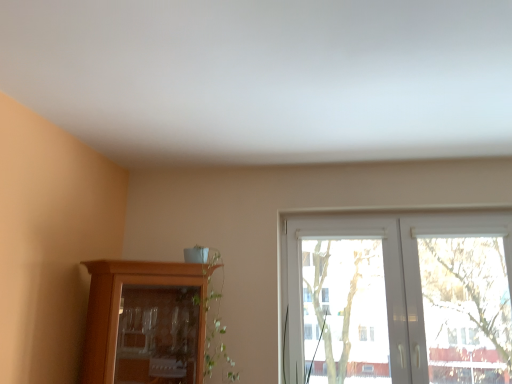
Question: Is wooden cabinet at lower left closer to camera compared to white plastic window at center?

Choices:
 (A) yes
 (B) no

Answer: (A)

Question: Could you tell me if wooden cabinet at lower left is turned towards white plastic window at center?

Choices:
 (A) no
 (B) yes

Answer: (A)

Question: Is wooden cabinet at lower left next to white plastic window at center and touching it?

Choices:
 (A) no
 (B) yes

Answer: (A)

Question: Would you consider wooden cabinet at lower left to be distant from white plastic window at center?

Choices:
 (A) no
 (B) yes

Answer: (B)

Question: From the image's perspective, is wooden cabinet at lower left over white plastic window at center?

Choices:
 (A) yes
 (B) no

Answer: (B)

Question: Is wooden cabinet at lower left shorter than white plastic window at center?

Choices:
 (A) no
 (B) yes

Answer: (B)

Question: Is white plastic window at center with wooden cabinet at lower left?

Choices:
 (A) no
 (B) yes

Answer: (A)

Question: Are white plastic window at center and wooden cabinet at lower left located far from each other?

Choices:
 (A) no
 (B) yes

Answer: (B)

Question: Considering the relative sizes of white plastic window at center and wooden cabinet at lower left in the image provided, is white plastic window at center thinner than wooden cabinet at lower left?

Choices:
 (A) yes
 (B) no

Answer: (A)

Question: From the image's perspective, is white plastic window at center on top of wooden cabinet at lower left?

Choices:
 (A) yes
 (B) no

Answer: (A)

Question: Does white plastic window at center contain wooden cabinet at lower left?

Choices:
 (A) no
 (B) yes

Answer: (A)

Question: Is white plastic window at center aimed at wooden cabinet at lower left?

Choices:
 (A) yes
 (B) no

Answer: (B)

Question: In terms of size, does wooden cabinet at lower left appear bigger or smaller than white plastic window at center?

Choices:
 (A) big
 (B) small

Answer: (A)